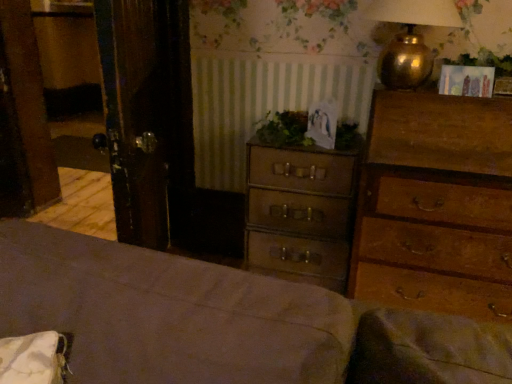
This screenshot has width=512, height=384. What are the coordinates of `blank space to the left of wooden picture frame at upper right` in the screenshot? It's located at (416, 94).